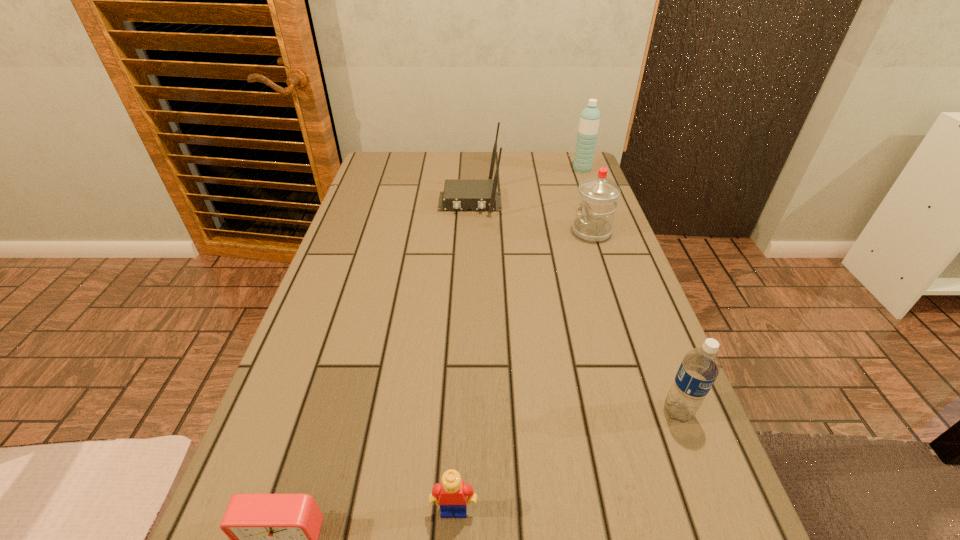
Find the location of a particular element. free spot located 0.330m on the handle side of the second nearest water bottle is located at coordinates (453, 232).

I want to click on vacant space located on the back of the third nearest object, so click(627, 278).

Where is `object that is positioned at the far edge`? The width and height of the screenshot is (960, 540). object that is positioned at the far edge is located at coordinates (x=589, y=121).

You are a GUI agent. You are given a task and a screenshot of the screen. Output one action in this format:
    pyautogui.click(x=<x>, y=<y>)
    Task: Click on the object situated at the far right corner
    The width and height of the screenshot is (960, 540).
    Given the screenshot: What is the action you would take?
    pyautogui.click(x=589, y=121)

Image resolution: width=960 pixels, height=540 pixels. In the image, there is a desktop. Identify the location of free region at the far edge. (508, 161).

The height and width of the screenshot is (540, 960). In the image, there is a desktop. Identify the location of vacant space at the left edge. (326, 278).

Identify the location of blank space at the right edge. (588, 348).

In the image, there is a desktop. In order to click on free space at the far right corner in this screenshot , I will do `click(555, 175)`.

You are a GUI agent. You are given a task and a screenshot of the screen. Output one action in this format:
    pyautogui.click(x=<x>, y=<y>)
    Task: Click on the vacant area between the tallest water bottle and the fifth nearest object
    This screenshot has width=960, height=540.
    Given the screenshot: What is the action you would take?
    pyautogui.click(x=526, y=186)

Identify the location of vacant space that is in between the nearest water bottle and the router. This screenshot has width=960, height=540. pos(574,307).